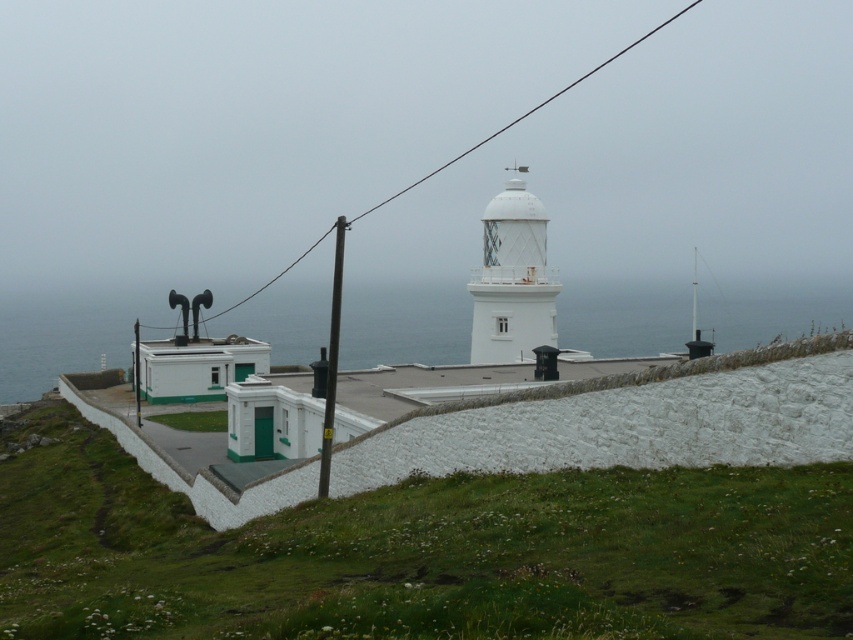
You are standing at the point marked as point (512, 280) in the coastal scene. What object are you directly at?

You are directly at the white textured lighthouse at center located at point (512, 280).

You are an engineer inspecting the lighthouse and the black wire. The white textured lighthouse at center needs to be painted. If the black wire at upper center is 10 meters wide, can the lighthouse be painted within the same budget? Assume the cost is proportional to the width.

The white textured lighthouse at center is narrower than the black wire at upper center, which is 10 meters wide. Since the lighthouse is less wide, it would require less paint and fit within the same budget.